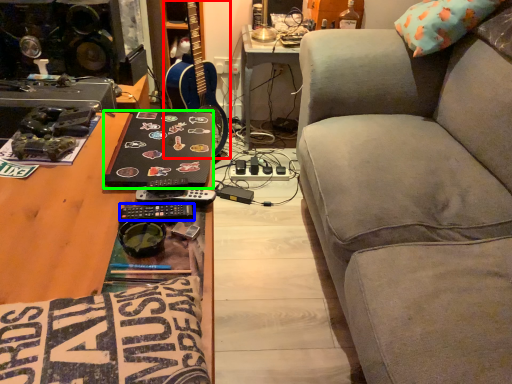
Question: Which object is the farthest from guitar (highlighted by a red box)? Choose among these: remote (highlighted by a blue box) or laptop (highlighted by a green box).

Choices:
 (A) remote
 (B) laptop

Answer: (A)